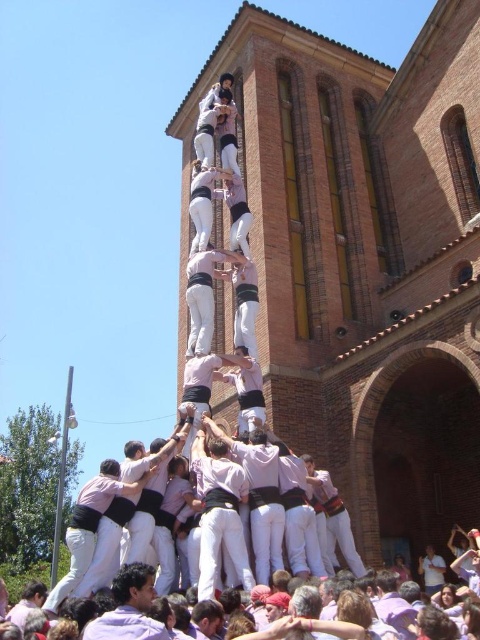
You are a photographer standing at the edge of the crowd, and you want to take a photo of the white cotton crowd at center and the pink cotton shirt at center. If your camera can focus on objects within a 1.5 meter range, will both subjects be in focus?

The white cotton crowd at center is 2.02 meters away from the pink cotton shirt at center. Since the camera can only focus within 1.5 meters, the two subjects are too far apart to both be in focus simultaneously.

You are standing at the base of the human tower and want to see the two points marked in the image. Which point, point (155,627) or point (213,332), is closer to you?

Point (155,627) is closer to you because it is in front of point (213,332).